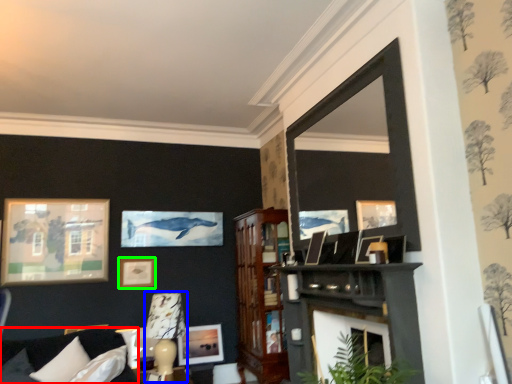
Question: Based on their relative distances, which object is nearer to couch (highlighted by a red box)? Choose from lamp (highlighted by a blue box) and picture frame (highlighted by a green box).

Choices:
 (A) lamp
 (B) picture frame

Answer: (A)